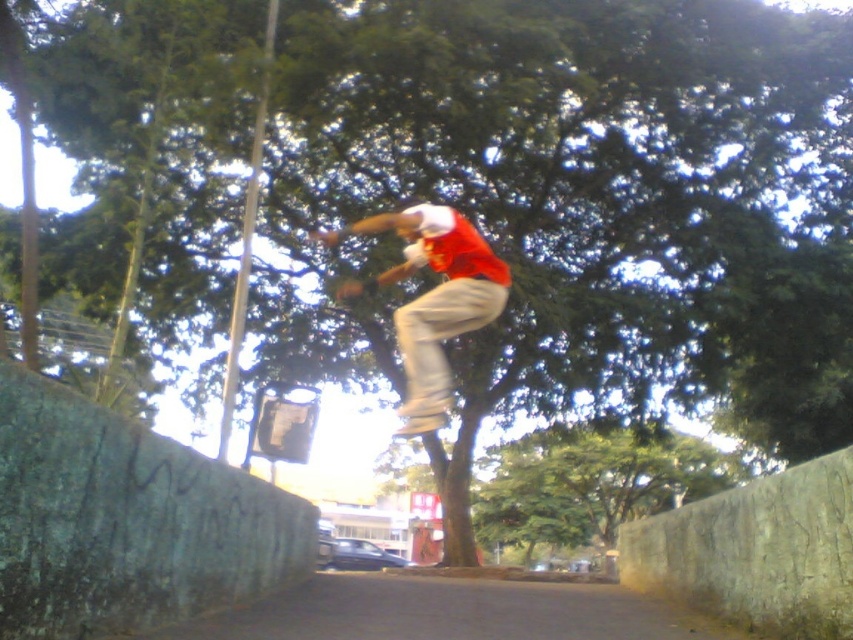
Question: Does matte red shirt at center appear over wooden skateboard at center?

Choices:
 (A) no
 (B) yes

Answer: (B)

Question: Which object is farther from the camera taking this photo?

Choices:
 (A) matte red shirt at center
 (B) wooden skateboard at center

Answer: (A)

Question: Does matte red shirt at center have a greater width compared to wooden skateboard at center?

Choices:
 (A) yes
 (B) no

Answer: (A)

Question: Which point appears closest to the camera in this image?

Choices:
 (A) (409, 426)
 (B) (410, 392)

Answer: (A)

Question: Can you confirm if matte red shirt at center is bigger than wooden skateboard at center?

Choices:
 (A) yes
 (B) no

Answer: (A)